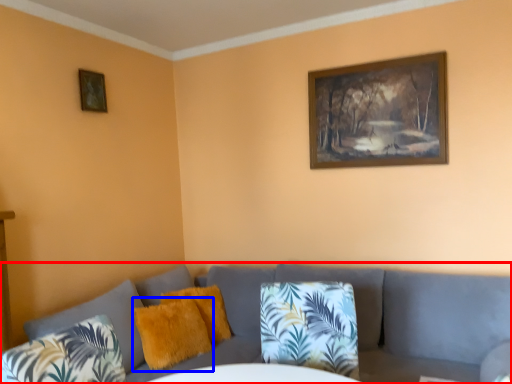
Question: Which of the following is the closest to the observer, studio couch (highlighted by a red box) or pillow (highlighted by a blue box)?

Choices:
 (A) studio couch
 (B) pillow

Answer: (A)